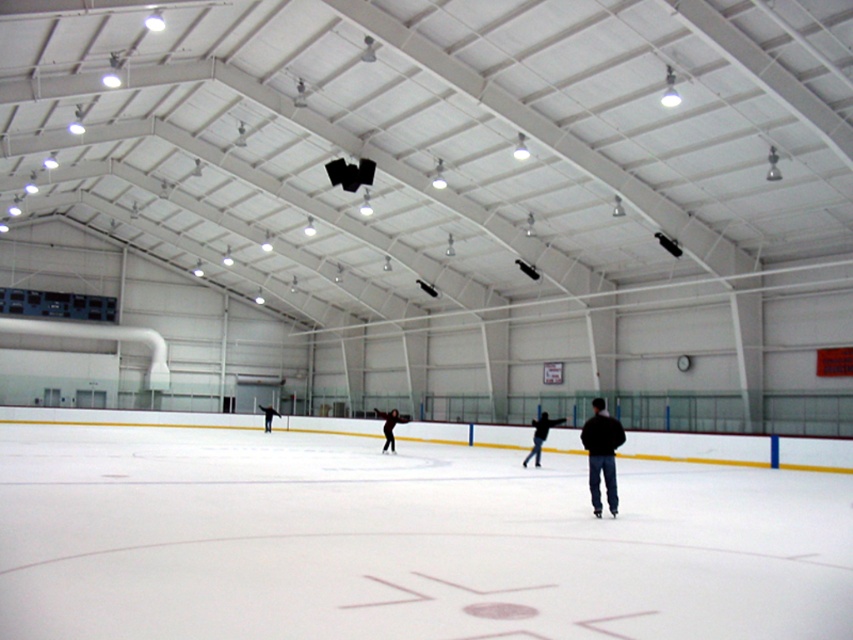
Who is more distant from viewer, (392, 552) or (544, 433)?

The point (544, 433) is more distant.

The height and width of the screenshot is (640, 853). Describe the element at coordinates (402, 541) in the screenshot. I see `white smooth ice at center` at that location.

Locate an element on the screen. This screenshot has width=853, height=640. white smooth ice at center is located at coordinates (402, 541).

Identify the location of white smooth ice at center. The width and height of the screenshot is (853, 640). point(402,541).

Can you confirm if white smooth ice at center is positioned to the right of dark blue jacket at center?

Incorrect, white smooth ice at center is not on the right side of dark blue jacket at center.

Between point (364, 484) and point (599, 404), which one is positioned behind?

Positioned behind is point (364, 484).

Where is `white smooth ice at center`? white smooth ice at center is located at coordinates (402, 541).

Looking at this image, between dark blue jacket at center and dark brown leather jacket at center, which one has more height?

dark brown leather jacket at center is taller.

The height and width of the screenshot is (640, 853). What do you see at coordinates (601, 452) in the screenshot?
I see `dark blue jacket at center` at bounding box center [601, 452].

You are a GUI agent. You are given a task and a screenshot of the screen. Output one action in this format:
    pyautogui.click(x=<x>, y=<y>)
    Task: Click on the dark blue jacket at center
    The image size is (853, 640).
    Given the screenshot: What is the action you would take?
    pyautogui.click(x=601, y=452)